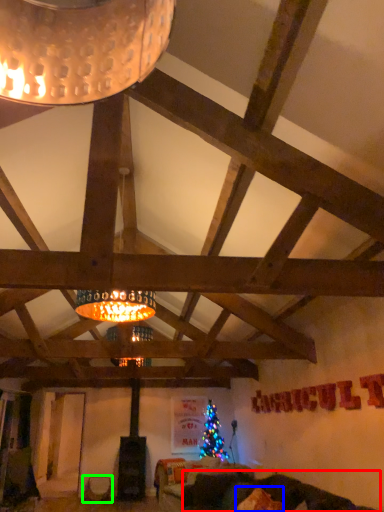
Question: Estimate the real-world distances between objects in this image. Which object is farther from couch (highlighted by a red box), pillow (highlighted by a blue box) or furniture (highlighted by a green box)?

Choices:
 (A) pillow
 (B) furniture

Answer: (B)